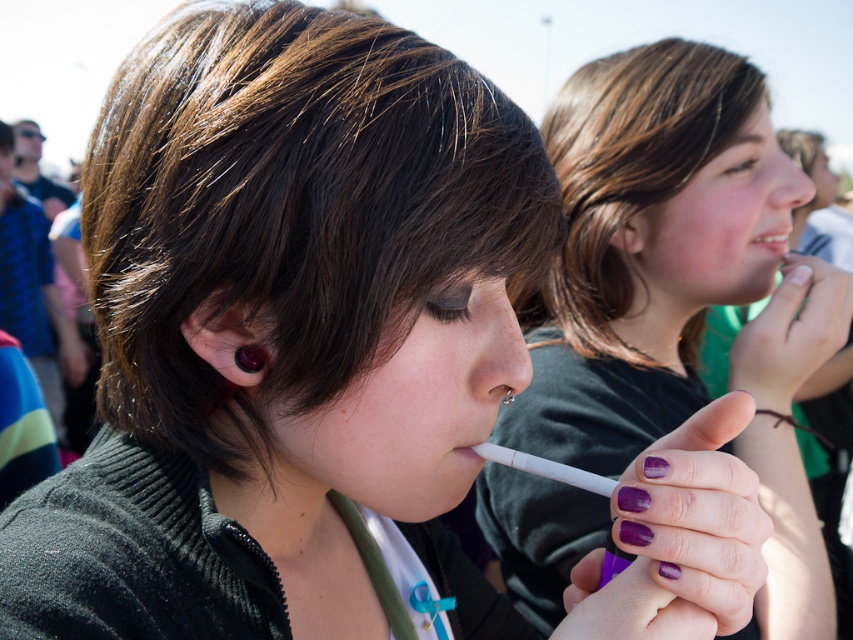
You are an artist trying to sketch the scene. Where exactly should you place the purple nail polish at center in terms of coordinates?

The purple nail polish at center should be placed at coordinates point (663, 256).

Based on the scene description, which object is positioned higher up in the image, the white glossy teeth at upper center or the purple matte lipstick at lower center?

The white glossy teeth at upper center is taller than the purple matte lipstick at lower center, so the white glossy teeth at upper center is positioned higher up in the image.